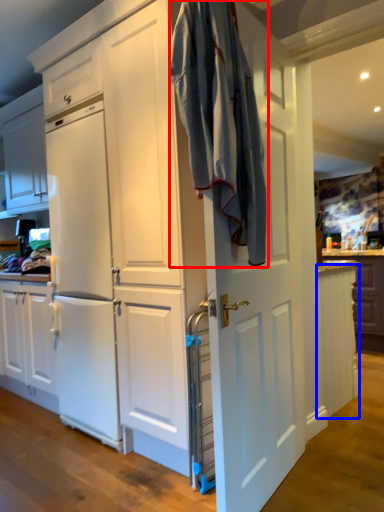
Question: Which point is further to the camera, laundry (highlighted by a red box) or cabinetry (highlighted by a blue box)?

Choices:
 (A) laundry
 (B) cabinetry

Answer: (B)